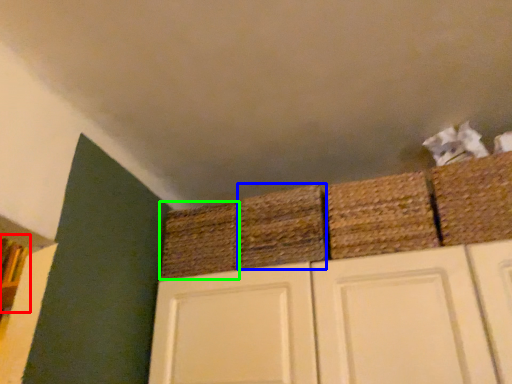
Question: Estimate the real-world distances between objects in this image. Which object is closer to shelf (highlighted by a red box), basket (highlighted by a blue box) or basket (highlighted by a green box)?

Choices:
 (A) basket
 (B) basket

Answer: (B)